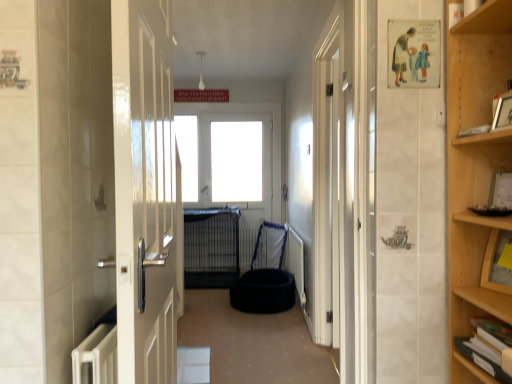
Question: Is dark blue plush dog bed at center directly adjacent to wooden picture frame at upper right?

Choices:
 (A) no
 (B) yes

Answer: (A)

Question: Considering the relative sizes of dark blue plush dog bed at center and wooden picture frame at upper right in the image provided, is dark blue plush dog bed at center bigger than wooden picture frame at upper right?

Choices:
 (A) yes
 (B) no

Answer: (A)

Question: From the image's perspective, does dark blue plush dog bed at center appear lower than wooden picture frame at upper right?

Choices:
 (A) no
 (B) yes

Answer: (B)

Question: From a real-world perspective, is dark blue plush dog bed at center physically above wooden picture frame at upper right?

Choices:
 (A) yes
 (B) no

Answer: (B)

Question: Does dark blue plush dog bed at center turn towards wooden picture frame at upper right?

Choices:
 (A) no
 (B) yes

Answer: (A)

Question: Is black wire cage at center spatially inside white paper at upper right, which is counted as the first book, starting from the top, or outside of it?

Choices:
 (A) inside
 (B) outside

Answer: (B)

Question: Is black wire cage at center taller or shorter than white paper at upper right, marked as the 2th book in a bottom-to-top arrangement?

Choices:
 (A) short
 (B) tall

Answer: (B)

Question: Is black wire cage at center in front of or behind white paper at upper right, marked as the 2th book in a bottom-to-top arrangement, in the image?

Choices:
 (A) front
 (B) behind

Answer: (B)

Question: From a real-world perspective, relative to white paper at upper right, marked as the 2th book in a bottom-to-top arrangement, is black wire cage at center vertically above or below?

Choices:
 (A) below
 (B) above

Answer: (A)

Question: From the image's perspective, is white glossy door at center above or below white paper at upper right, marked as the 2th book in a bottom-to-top arrangement?

Choices:
 (A) below
 (B) above

Answer: (A)

Question: Considering the positions of point coord(114,97) and point coord(482,125), is point coord(114,97) closer or farther from the camera than point coord(482,125)?

Choices:
 (A) farther
 (B) closer

Answer: (B)

Question: Visually, is white glossy door at center positioned to the left or to the right of white paper at upper right, marked as the 2th book in a bottom-to-top arrangement?

Choices:
 (A) right
 (B) left

Answer: (B)

Question: Is white glossy door at center spatially inside white paper at upper right, marked as the 2th book in a bottom-to-top arrangement, or outside of it?

Choices:
 (A) inside
 (B) outside

Answer: (B)

Question: In terms of size, does white glossy window at center appear bigger or smaller than white plastic radiator at lower center?

Choices:
 (A) small
 (B) big

Answer: (B)

Question: Considering their positions, is white glossy window at center located in front of or behind white plastic radiator at lower center?

Choices:
 (A) front
 (B) behind

Answer: (B)